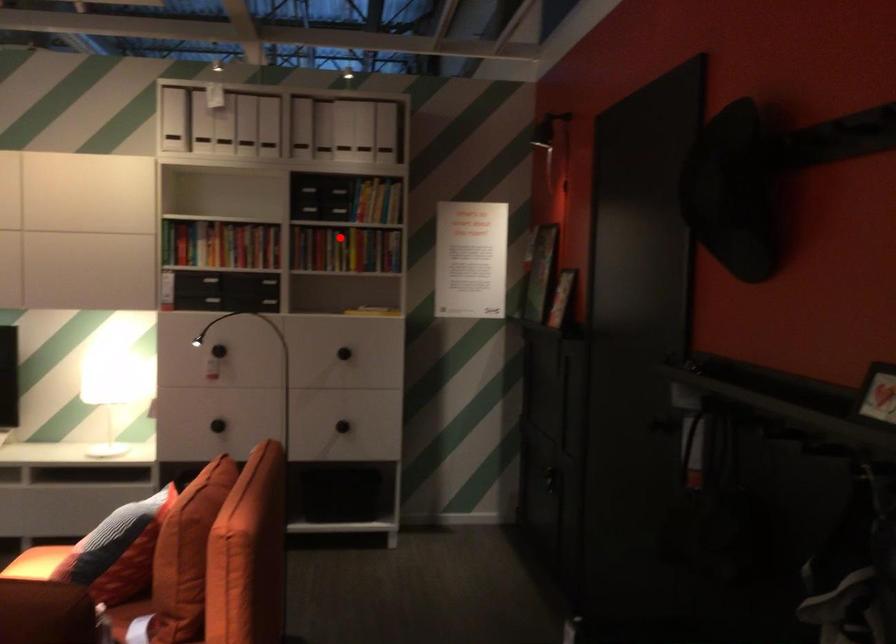
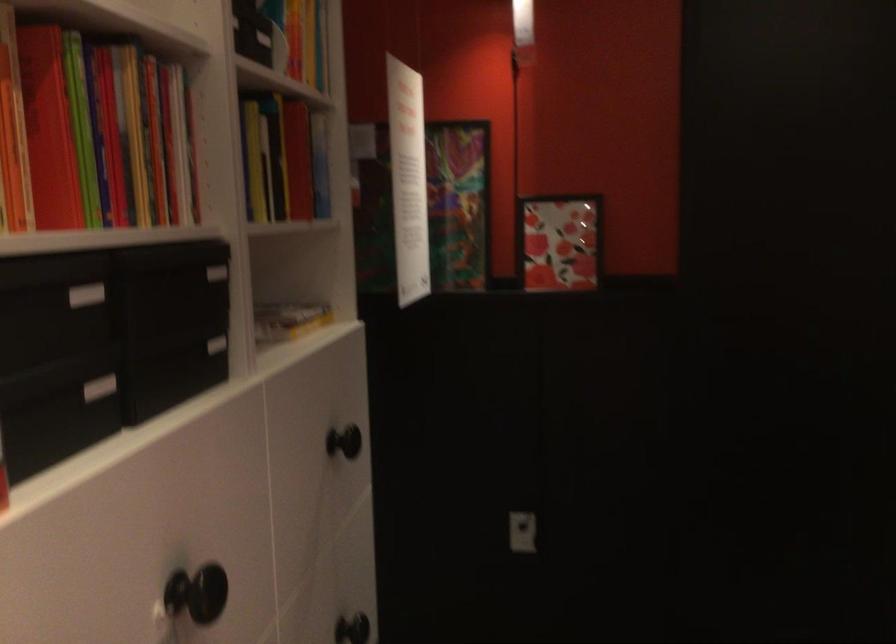
Find the pixel in the second image that matches the highlighted location in the first image.

(282, 158)